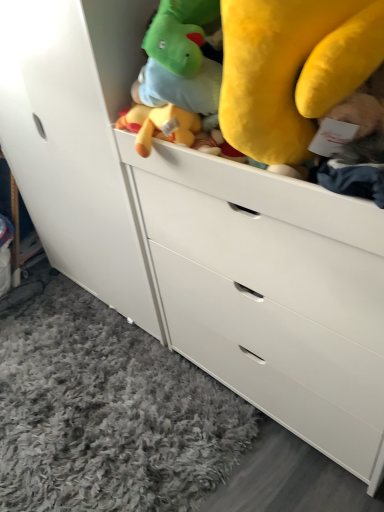
Question: From the image's perspective, is white matte cabinet at upper center located above or below gray shag rug at lower left?

Choices:
 (A) below
 (B) above

Answer: (B)

Question: Is white matte cabinet at upper center wider or thinner than gray shag rug at lower left?

Choices:
 (A) wide
 (B) thin

Answer: (B)

Question: Based on their positions, is white matte cabinet at upper center located to the left or right of gray shag rug at lower left?

Choices:
 (A) left
 (B) right

Answer: (B)

Question: In terms of width, does gray shag rug at lower left look wider or thinner when compared to white matte cabinet at upper center?

Choices:
 (A) thin
 (B) wide

Answer: (B)

Question: From the image's perspective, is gray shag rug at lower left positioned above or below white matte cabinet at upper center?

Choices:
 (A) below
 (B) above

Answer: (A)

Question: In the image, is gray shag rug at lower left positioned in front of or behind white matte cabinet at upper center?

Choices:
 (A) front
 (B) behind

Answer: (B)

Question: From a real-world perspective, is gray shag rug at lower left positioned above or below white matte cabinet at upper center?

Choices:
 (A) above
 (B) below

Answer: (B)